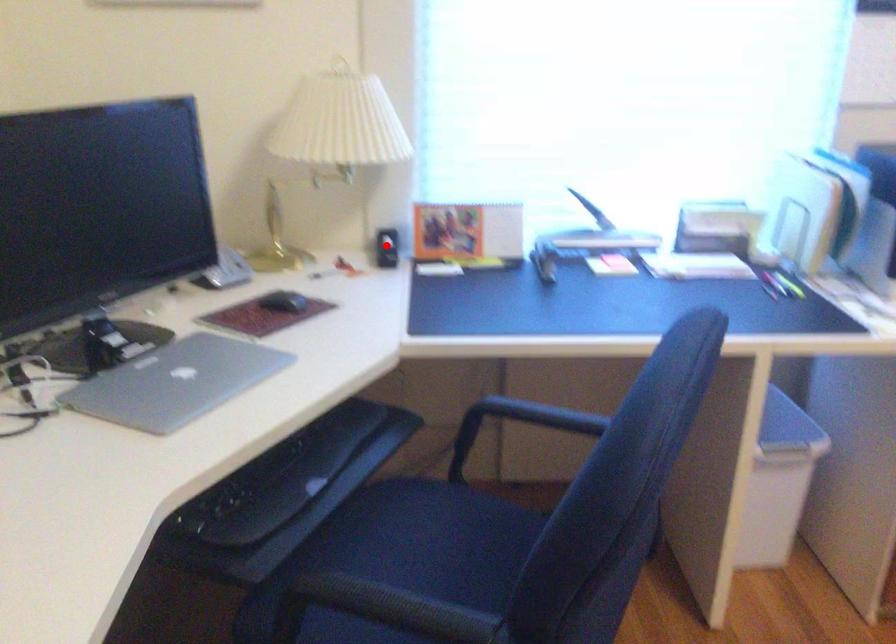
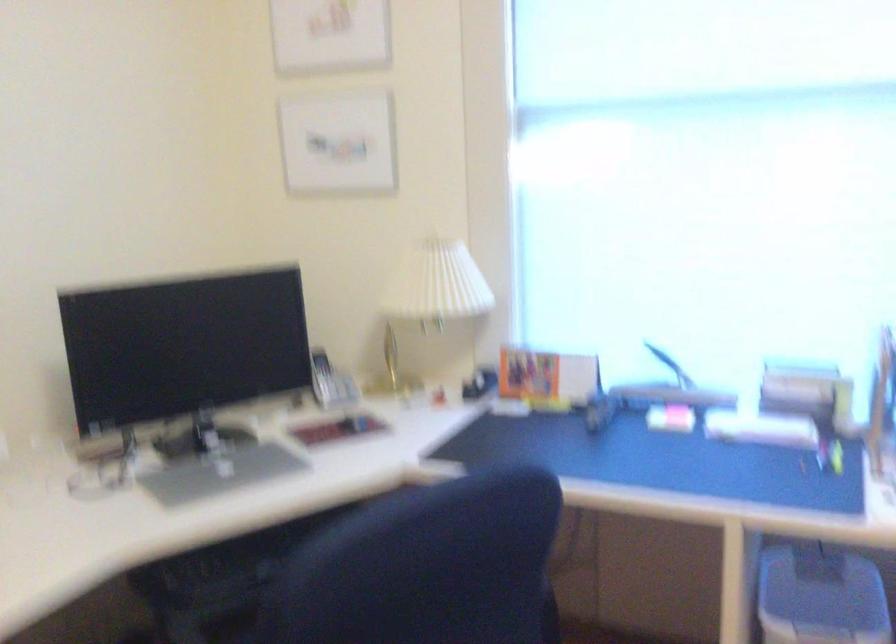
Where in the second image is the point corresponding to the highlighted location from the first image?

(479, 383)